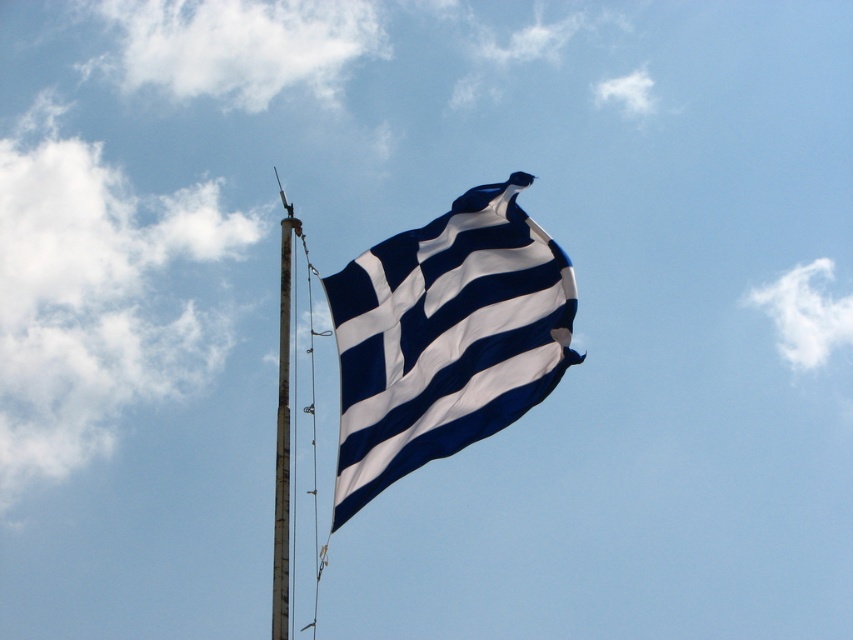
You are a photographer standing at the base of the flagpole. You want to capture the Greek flag at point (x=445, y=337) in the center of your camera frame. The flagpole is 10 meters tall. If your camera has a maximum zoom range of 5 meters, can you zoom in enough to fill the frame with just the flag?

The blue white fabric flag at center is located at point 0.528 0.523. Since the flagpole is 10 meters tall and the camera can zoom up to 5 meters, the camera cannot reach the required zoom to fill the frame with just the flag as the zoom range is insufficient.